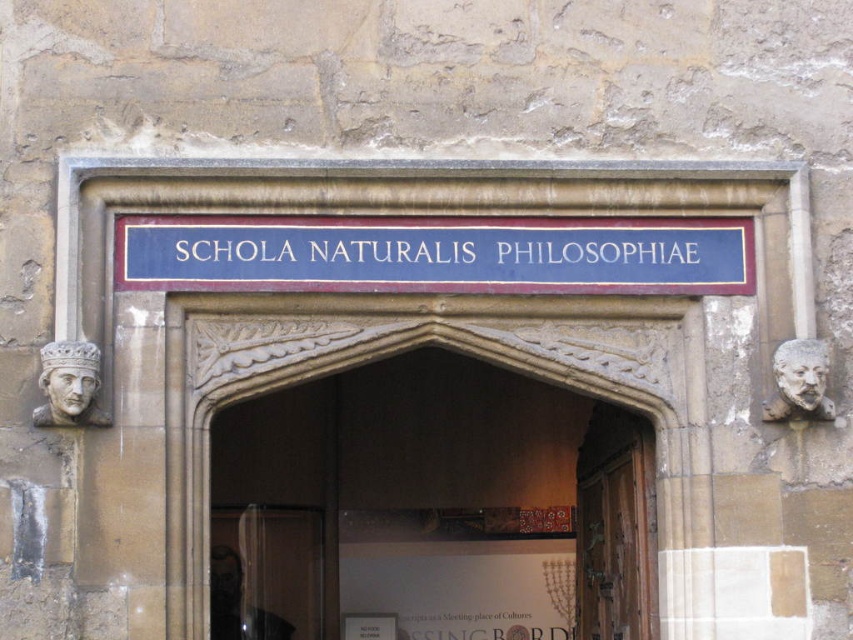
You are standing at the entrance of the building and want to locate the blue painted wood sign at center. According to the coordinates provided, where exactly is the sign positioned?

The blue painted wood sign at center is located at point (436, 253), which means it is positioned slightly to the right and above the center of the entrance area based on the coordinate system provided.

You are standing at the entrance of the building and want to locate the blue painted wood sign at center. According to the coordinates given, where would you look to find it?

The blue painted wood sign at center is located at the coordinates point (436,253).

You are standing at the entrance of the building and want to take a photo that includes both the ornate archway and the sign above it. The archway is represented by the point at coordinates point (508, 269) and the sign by point (643, 412). Which point should you focus on first to ensure both are in focus?

You should focus on point (508, 269) first because it is closer to the camera than point (643, 412). This ensures that the archway is in focus, and since the sign is further away, adjusting the focus from the closer point outward will help capture both elements clearly.